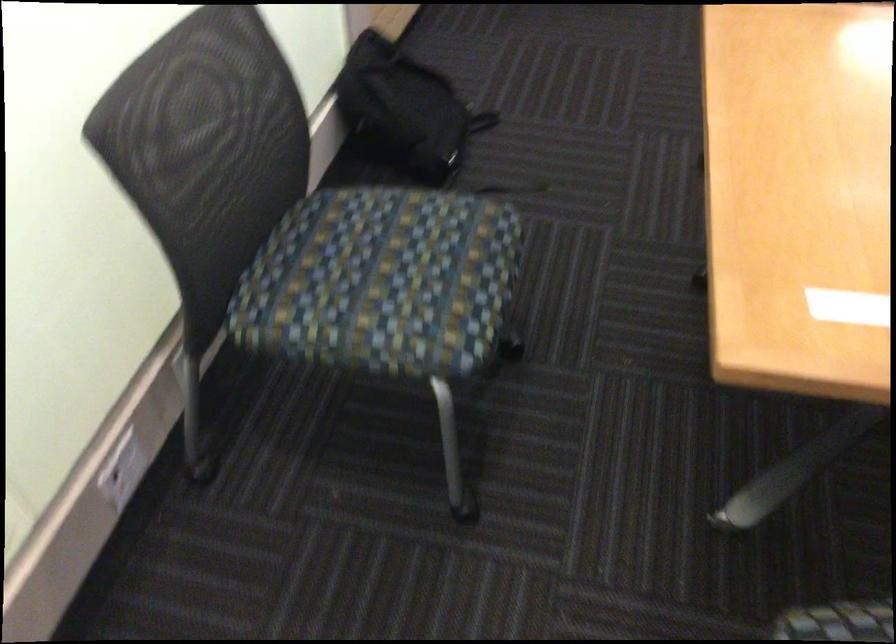
What are the coordinates of `chair sitting surface` in the screenshot? It's located at (382, 281).